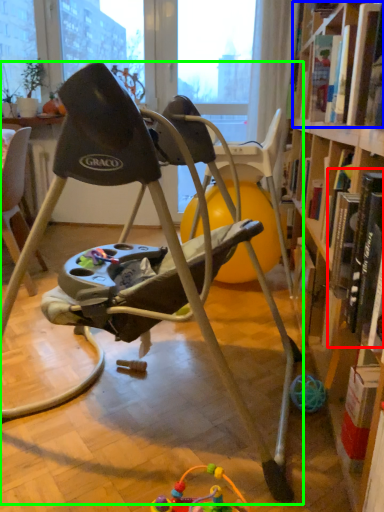
Question: Which object is positioned closest to book (highlighted by a red box)? Select from book (highlighted by a blue box) and chair (highlighted by a green box).

Choices:
 (A) book
 (B) chair

Answer: (B)